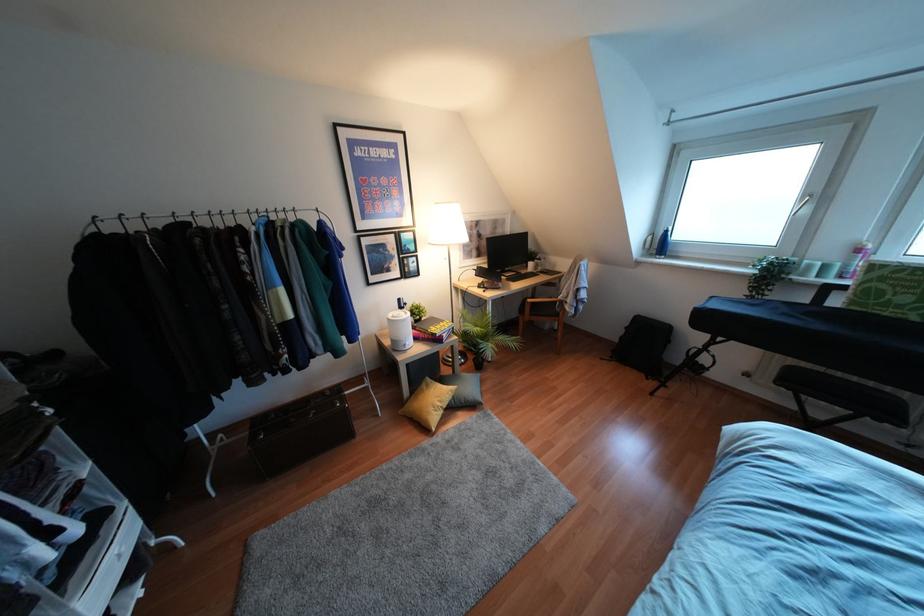
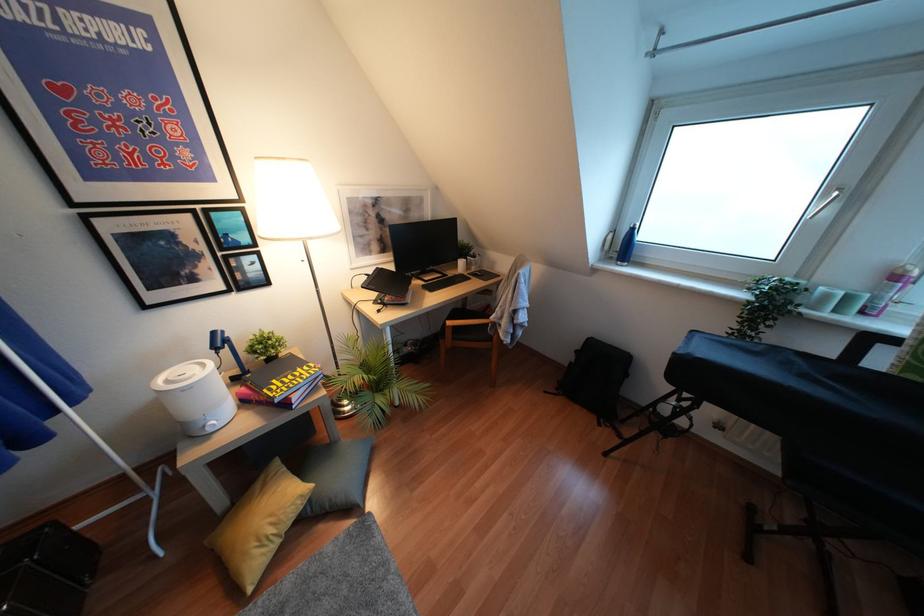
Locate, in the second image, the point that corresponds to (858,249) in the first image.

(895, 277)